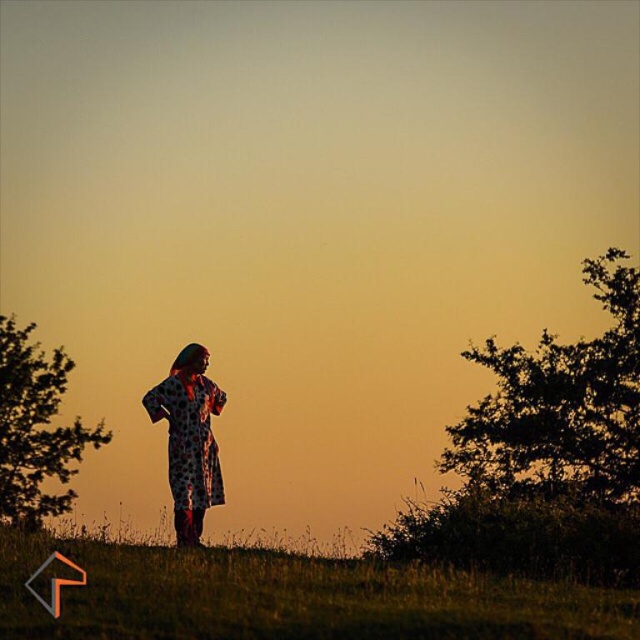
You are standing at the point labeled point (419, 611) and want to walk to the point labeled point (72, 502). Given that you can only move forward in a straight line, will you be able to reach the destination without any obstacles?

Yes, because point (419, 611) is in front of point (72, 502), so moving forward in a straight line from point (419, 611) towards the destination would allow you to reach point (72, 502) without obstruction.

You are standing in the serene outdoor scene and want to place a small bench between the green grassy at lower center and the green leafy tree at left. Based on their positions, where should the bench be placed?

The green grassy at lower center is located above the green leafy tree at left, so the bench should be placed between the green grassy at lower center and the green leafy tree at left, which means it should be positioned above the tree and below the grassy area.